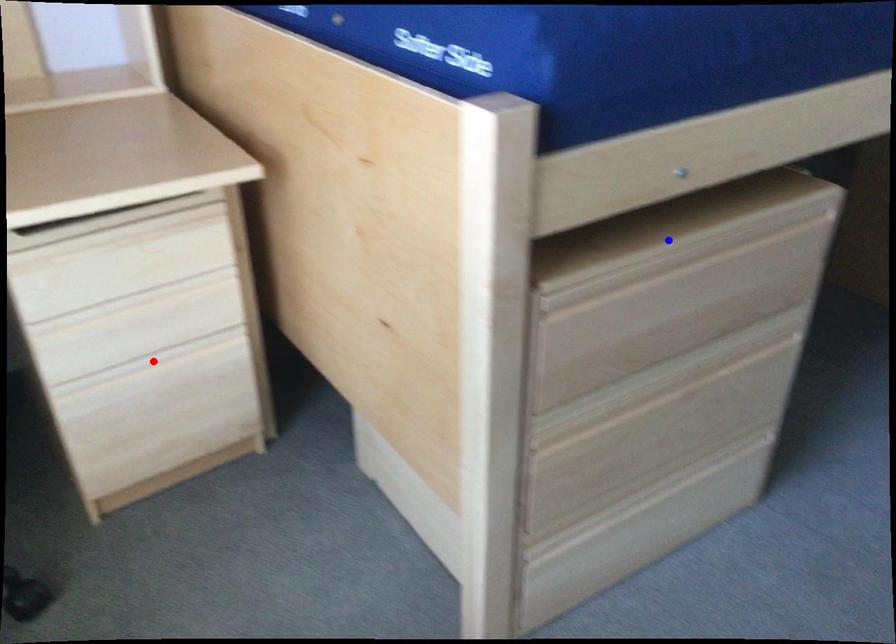
Question: In the image, two points are highlighted. Which point is nearer to the camera? Reply with the corresponding letter.

Choices:
 (A) blue point
 (B) red point

Answer: (A)